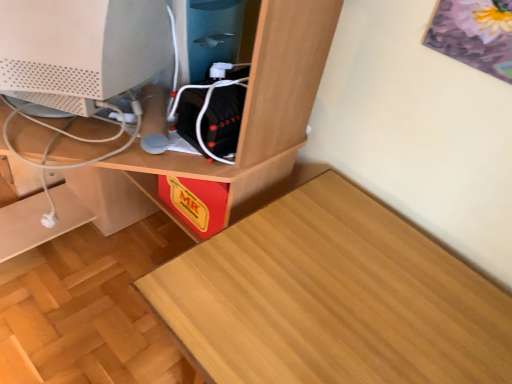
The image size is (512, 384). What are the coordinates of `free space above wooden table at lower left (from a real-world perspective)` in the screenshot? It's located at (338, 310).